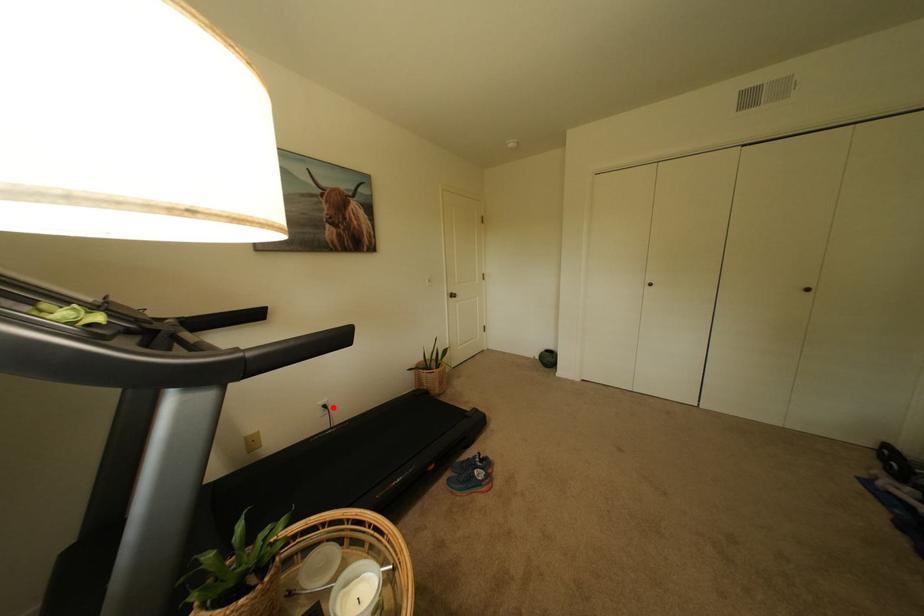
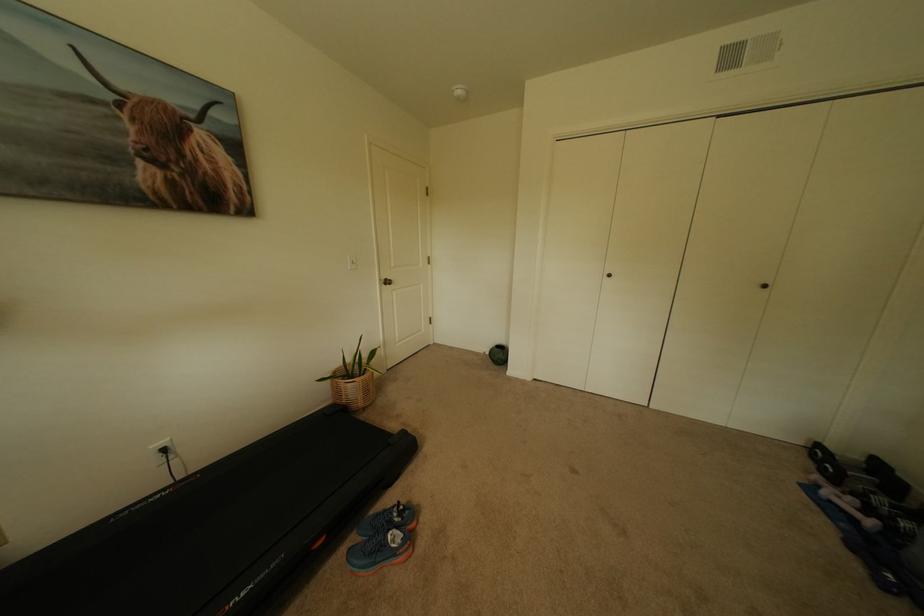
Question: I am providing you with two images of the same scene from different viewpoints. A red point is shown in image1. For the corresponding object point in image2, is it positioned nearer or farther from the camera?

Choices:
 (A) Nearer
 (B) Farther

Answer: (B)